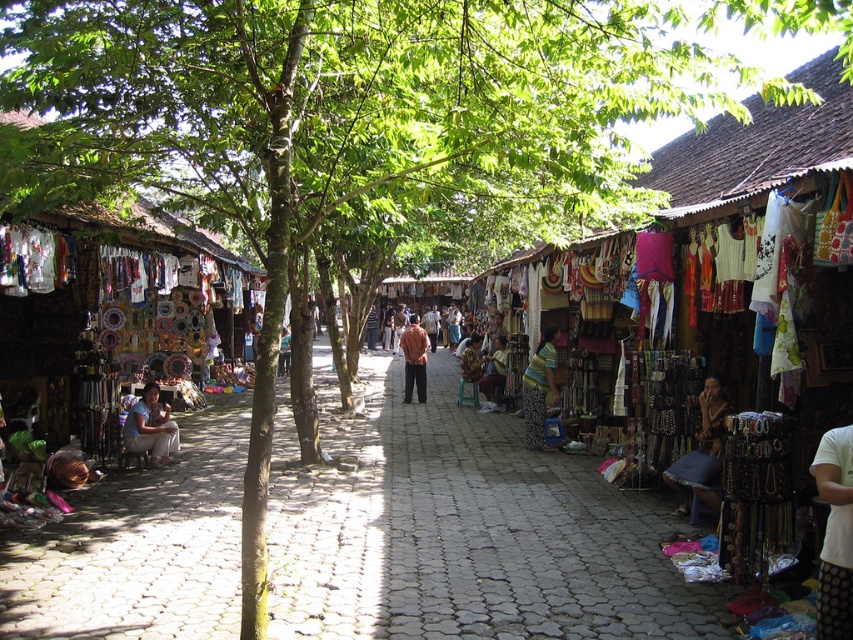
You are a customer at the market and want to buy both the striped fabric skirt at center and the matte white fabric at center. Which one is positioned to the right side of the other?

The striped fabric skirt at center is positioned to the right of the matte white fabric at center.

You are a customer at the outdoor market and want to buy a fabric item. You see the striped fabric skirt at center and the matte white fabric at center. Which fabric item is taller?

The striped fabric skirt at center is much taller than the matte white fabric at center.